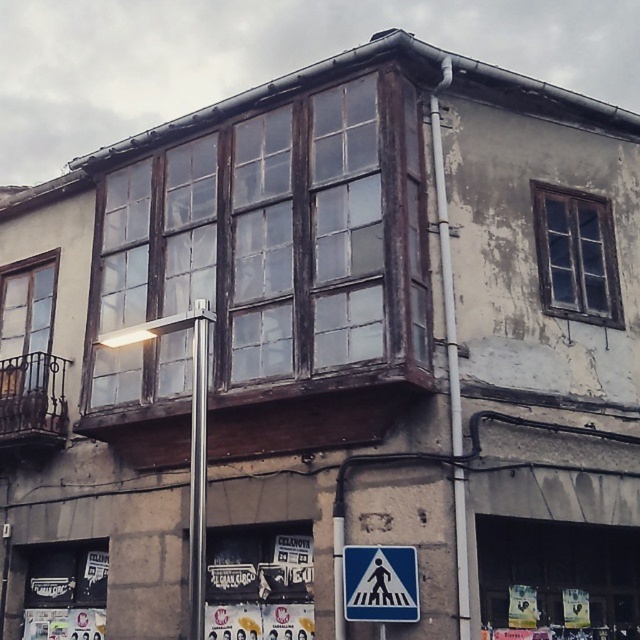
Is wooden bay window at center above silver metallic pole at center?

Yes, wooden bay window at center is above silver metallic pole at center.

Is wooden bay window at center positioned at the back of silver metallic pole at center?

Yes, wooden bay window at center is further from the viewer.

You are a GUI agent. You are given a task and a screenshot of the screen. Output one action in this format:
    pyautogui.click(x=<x>, y=<y>)
    Task: Click on the wooden bay window at center
    The height and width of the screenshot is (640, 640).
    Given the screenshot: What is the action you would take?
    pyautogui.click(x=282, y=241)

Between dark brown wooden window at upper right and wooden balcony at left, which one appears on the right side from the viewer's perspective?

Positioned to the right is dark brown wooden window at upper right.

Is point (604, 301) positioned before point (49, 412)?

That is True.

Where is `dark brown wooden window at upper right`? dark brown wooden window at upper right is located at coordinates tap(577, 253).

At what (x,y) coordinates should I click in order to perform the action: click on dark brown wooden window at upper right. Please return your answer as a coordinate pair (x, y). This screenshot has width=640, height=640. Looking at the image, I should click on (577, 253).

Does dark brown wooden window at upper right come behind blue plastic pedestrian crossing sign at lower center?

Yes.

Is point (547, 257) in front of point (369, 611)?

No.

Does point (554, 192) come behind point (412, 579)?

Yes, it is.

Where is `dark brown wooden window at upper right`? This screenshot has width=640, height=640. dark brown wooden window at upper right is located at coordinates (577, 253).